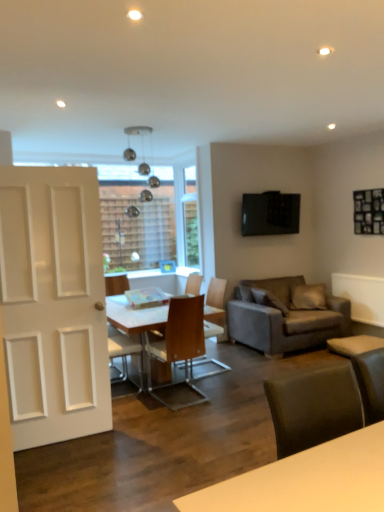
What do you see at coordinates (135, 321) in the screenshot? The height and width of the screenshot is (512, 384). I see `white glossy table at center` at bounding box center [135, 321].

At what (x,y) coordinates should I click in order to perform the action: click on wooden chair at center, the fourth chair in the back-to-front sequence. Please return your answer as a coordinate pair (x, y). The height and width of the screenshot is (512, 384). Looking at the image, I should click on pyautogui.click(x=180, y=341).

What do you see at coordinates (193, 284) in the screenshot?
I see `wooden chair at center, which ranks as the fourth chair in front-to-back order` at bounding box center [193, 284].

In order to click on wooden chair at center, positioned as the 2th chair in back-to-front order in this screenshot , I will do `click(214, 308)`.

Measure the distance between white matte door at left and camera.

A distance of 9.66 feet exists between white matte door at left and camera.

Measure the distance between point [322,284] and camera.

Point [322,284] is 6.31 meters from camera.

This screenshot has width=384, height=512. In order to click on light brown wooden chair at center, which ranks as the third chair in back-to-front order in this screenshot , I will do `click(121, 351)`.

Where is `white glossy table at center`? This screenshot has width=384, height=512. white glossy table at center is located at coordinates (135, 321).

Can you confirm if white matte door at left is shorter than wooden chair at center, positioned as the 2th chair in back-to-front order?

Incorrect, the height of white matte door at left does not fall short of that of wooden chair at center, positioned as the 2th chair in back-to-front order.

Consider the image. Between white matte door at left and wooden chair at center, positioned as the 2th chair in back-to-front order, which one has smaller size?

With smaller size is wooden chair at center, positioned as the 2th chair in back-to-front order.

From the image's perspective, which one is positioned higher, white matte door at left or wooden chair at center, positioned as the 2th chair in back-to-front order?

white matte door at left is shown above in the image.

Considering the relative positions of white glossy table at center and wooden chair at center, which ranks as the fourth chair in front-to-back order, in the image provided, is white glossy table at center in front of wooden chair at center, which ranks as the fourth chair in front-to-back order,?

Yes, it is in front of wooden chair at center, which ranks as the fourth chair in front-to-back order.

Measure the distance from white glossy table at center to wooden chair at center, which appears as the first chair when viewed from the back.

1.14 meters.

Choose the correct answer: Is white glossy table at center inside wooden chair at center, which ranks as the fourth chair in front-to-back order, or outside it?

white glossy table at center is outside wooden chair at center, which ranks as the fourth chair in front-to-back order.

Based on the photo, looking at their sizes, would you say white glossy table at center is wider or thinner than wooden chair at center, which appears as the first chair when viewed from the back?

Clearly, white glossy table at center has more width compared to wooden chair at center, which appears as the first chair when viewed from the back.

From a real-world perspective, is wooden chair at center, the fourth chair in the back-to-front sequence, on top of white glossy table at center?

Yes, from a real-world perspective, wooden chair at center, the fourth chair in the back-to-front sequence, is over white glossy table at center

Relative to white glossy table at center, is wooden chair at center, arranged as the first chair when viewed from the front, in front or behind?

Clearly, wooden chair at center, arranged as the first chair when viewed from the front, is in front of white glossy table at center.

How many degrees apart are the facing directions of wooden chair at center, arranged as the first chair when viewed from the front, and white glossy table at center?

178 degrees.

Is white glossy table at center inside or outside of white matte door at left?

white glossy table at center lies outside white matte door at left.

Looking at their sizes, would you say white glossy table at center is wider or thinner than white matte door at left?

Considering their sizes, white glossy table at center looks broader than white matte door at left.

How distant is white glossy table at center from white matte door at left?

white glossy table at center and white matte door at left are 32.95 inches apart.

How different are the orientations of metallic glass light fixture at upper center and wooden chair at center, the fourth chair in the back-to-front sequence, in degrees?

The angle between the facing direction of metallic glass light fixture at upper center and the facing direction of wooden chair at center, the fourth chair in the back-to-front sequence, is 178 degrees.

Is metallic glass light fixture at upper center not within wooden chair at center, arranged as the first chair when viewed from the front?

Yes, metallic glass light fixture at upper center is not within wooden chair at center, arranged as the first chair when viewed from the front.

In the scene shown: From a real-world perspective, is metallic glass light fixture at upper center on top of wooden chair at center, the fourth chair in the back-to-front sequence?

Indeed, from a real-world perspective, metallic glass light fixture at upper center stands above wooden chair at center, the fourth chair in the back-to-front sequence.

Is light brown wooden chair at center, placed as the second chair when sorted from front to back, further to camera compared to wooden chair at center, positioned as the 2th chair in back-to-front order?

No, light brown wooden chair at center, placed as the second chair when sorted from front to back, is closer to the camera.

Would you consider light brown wooden chair at center, placed as the second chair when sorted from front to back, to be distant from wooden chair at center, positioned as the 2th chair in back-to-front order?

They are positioned close to each other.

Is light brown wooden chair at center, which ranks as the third chair in back-to-front order, surrounding wooden chair at center, positioned as the 2th chair in back-to-front order?

Actually, wooden chair at center, positioned as the 2th chair in back-to-front order, is outside light brown wooden chair at center, which ranks as the third chair in back-to-front order.

There is a wooden chair at center, marked as the 3th chair in a front-to-back arrangement. Where is `the 2nd chair below it (from the image's perspective)`? the 2nd chair below it (from the image's perspective) is located at coordinates (121, 351).

Is white matte door at left turned away from wooden chair at center, which ranks as the fourth chair in front-to-back order?

No, white matte door at left is not facing the opposite direction of wooden chair at center, which ranks as the fourth chair in front-to-back order.

Is wooden chair at center, which ranks as the fourth chair in front-to-back order, located within white matte door at left?

Definitely not — wooden chair at center, which ranks as the fourth chair in front-to-back order, is not inside white matte door at left.

Looking at their sizes, would you say white matte door at left is wider or thinner than wooden chair at center, which appears as the first chair when viewed from the back?

Considering their sizes, white matte door at left looks slimmer than wooden chair at center, which appears as the first chair when viewed from the back.

Does white matte door at left appear on the left side of wooden chair at center, which appears as the first chair when viewed from the back?

Yes, white matte door at left is to the left of wooden chair at center, which appears as the first chair when viewed from the back.

You are a GUI agent. You are given a task and a screenshot of the screen. Output one action in this format:
    pyautogui.click(x=<x>, y=<y>)
    Task: Click on the door positioned vertically above the wooden chair at center, positioned as the 2th chair in back-to-front order (from a real-world perspective)
    The width and height of the screenshot is (384, 512).
    Given the screenshot: What is the action you would take?
    pyautogui.click(x=53, y=304)

At what (x,y) coordinates should I click in order to perform the action: click on table that is on the left side of wooden chair at center, which ranks as the fourth chair in front-to-back order. Please return your answer as a coordinate pair (x, y). The height and width of the screenshot is (512, 384). Looking at the image, I should click on (135, 321).

Based on their spatial positions, is white matte door at left or white glossy table at center closer to wooden chair at center, which appears as the first chair when viewed from the back?

white glossy table at center is closer to wooden chair at center, which appears as the first chair when viewed from the back.

Estimate the real-world distances between objects in this image. Which object is further from dark gray fabric couch at center right, metallic glass light fixture at upper center or wooden chair at center, marked as the 3th chair in a front-to-back arrangement?

Among the two, metallic glass light fixture at upper center is located further to dark gray fabric couch at center right.

When comparing their distances from metallic glass light fixture at upper center, does wooden chair at center, which appears as the first chair when viewed from the back, or white matte door at left seem further?

white matte door at left is further to metallic glass light fixture at upper center.

Looking at the image, which one is located closer to dark gray fabric couch at center right, light brown wooden chair at center, which ranks as the third chair in back-to-front order, or white matte door at left?

Based on the image, light brown wooden chair at center, which ranks as the third chair in back-to-front order, appears to be nearer to dark gray fabric couch at center right.

Based on their spatial positions, is dark gray fabric couch at center right or metallic glass light fixture at upper center closer to white glossy table at center?

The object closer to white glossy table at center is dark gray fabric couch at center right.

Which object lies further to the anchor point wooden chair at center, which ranks as the fourth chair in front-to-back order, wooden chair at center, the fourth chair in the back-to-front sequence, or white matte door at left?

white matte door at left.

Looking at the image, which one is located further to wooden chair at center, the fourth chair in the back-to-front sequence, wooden chair at center, which appears as the first chair when viewed from the back, or light brown wooden chair at center, placed as the second chair when sorted from front to back?

Among the two, wooden chair at center, which appears as the first chair when viewed from the back, is located further to wooden chair at center, the fourth chair in the back-to-front sequence.

Which object lies nearer to the anchor point metallic glass light fixture at upper center, wooden chair at center, the fourth chair in the back-to-front sequence, or wooden chair at center, marked as the 3th chair in a front-to-back arrangement?

wooden chair at center, marked as the 3th chair in a front-to-back arrangement.

Find the location of a particular element. This screenshot has height=512, width=384. chair positioned between light brown wooden chair at center, which ranks as the third chair in back-to-front order, and wooden chair at center, which ranks as the fourth chair in front-to-back order, from near to far is located at coordinates (214, 308).

Image resolution: width=384 pixels, height=512 pixels. Identify the location of table positioned between white matte door at left and wooden chair at center, marked as the 3th chair in a front-to-back arrangement, from near to far. (135, 321).

Find the location of a particular element. studio couch between metallic glass light fixture at upper center and wooden chair at center, the fourth chair in the back-to-front sequence, in the vertical direction is located at coordinates (286, 315).

At what (x,y) coordinates should I click in order to perform the action: click on chair between white matte door at left and light brown wooden chair at center, placed as the second chair when sorted from front to back, along the z-axis. Please return your answer as a coordinate pair (x, y). Looking at the image, I should click on (180, 341).